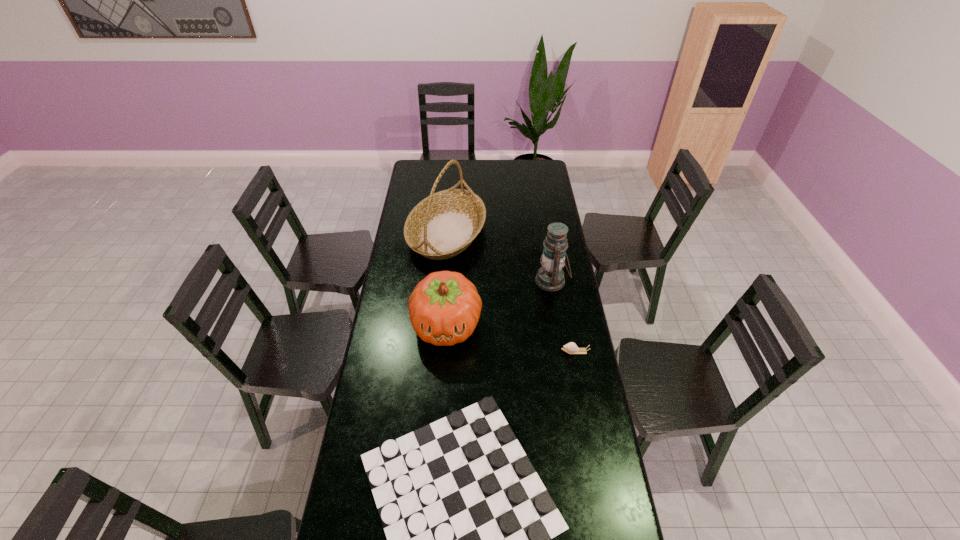
Identify the location of basket present at the left edge. The width and height of the screenshot is (960, 540). (441, 226).

Where is `pumpkin at the left edge`? Image resolution: width=960 pixels, height=540 pixels. pumpkin at the left edge is located at coordinates (444, 308).

You are a GUI agent. You are given a task and a screenshot of the screen. Output one action in this format:
    pyautogui.click(x=<x>, y=<y>)
    Task: Click on the oil lamp located in the right edge section of the desktop
    
    Given the screenshot: What is the action you would take?
    pyautogui.click(x=550, y=277)

This screenshot has height=540, width=960. Identify the location of escargot that is at the right edge. (571, 348).

The image size is (960, 540). I want to click on free space at the far edge, so [498, 166].

At what (x,y) coordinates should I click in order to perform the action: click on free space at the left edge. Please return your answer as a coordinate pair (x, y). Looking at the image, I should click on click(396, 347).

In the image, there is a desktop. At what (x,y) coordinates should I click in order to perform the action: click on vacant space at the right edge. Please return your answer as a coordinate pair (x, y). Image resolution: width=960 pixels, height=540 pixels. Looking at the image, I should click on (560, 428).

At what (x,y) coordinates should I click in order to perform the action: click on vacant space at the far left corner of the desktop. Please return your answer as a coordinate pair (x, y). Looking at the image, I should click on (426, 160).

The image size is (960, 540). In the image, there is a desktop. In order to click on blank space at the far right corner in this screenshot , I will do `click(551, 175)`.

Where is `vacant space that is in between the oil lamp and the basket`? vacant space that is in between the oil lamp and the basket is located at coordinates (499, 257).